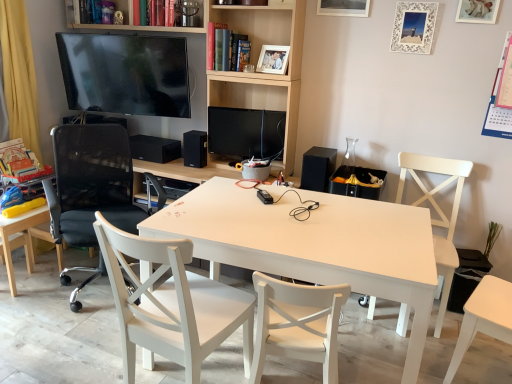
Describe the element at coordinates (477, 11) in the screenshot. I see `matte white picture frame at upper right, placed as the first picture frame when sorted from right to left` at that location.

Describe the element at coordinates (414, 27) in the screenshot. I see `white lace picture frame at upper right, placed as the third picture frame when sorted from left to right` at that location.

The width and height of the screenshot is (512, 384). Describe the element at coordinates (172, 303) in the screenshot. I see `white wood chair at center, the 3th chair viewed from the left` at that location.

How much space does white matte chair at center, arranged as the fourth chair when viewed from the left, occupy vertically?

The height of white matte chair at center, arranged as the fourth chair when viewed from the left, is 30.88 inches.

Where is `matte white picture frame at upper right, which is the fourth picture frame from left to right`? Image resolution: width=512 pixels, height=384 pixels. matte white picture frame at upper right, which is the fourth picture frame from left to right is located at coordinates (477, 11).

Consider the image. Which of these two, wooden photo frame at upper center, the 4th picture frame positioned from the right, or matte white picture frame at upper right, placed as the first picture frame when sorted from right to left, is smaller?

With smaller size is matte white picture frame at upper right, placed as the first picture frame when sorted from right to left.

Could you measure the distance between wooden photo frame at upper center, the 4th picture frame positioned from the right, and matte white picture frame at upper right, which is the fourth picture frame from left to right?

A distance of 3.53 feet exists between wooden photo frame at upper center, the 4th picture frame positioned from the right, and matte white picture frame at upper right, which is the fourth picture frame from left to right.

From the picture: Is wooden photo frame at upper center, the 1th picture frame in the left-to-right sequence, located outside matte white picture frame at upper right, placed as the first picture frame when sorted from right to left?

That's correct, wooden photo frame at upper center, the 1th picture frame in the left-to-right sequence, is outside of matte white picture frame at upper right, placed as the first picture frame when sorted from right to left.

Looking at their sizes, would you say wooden photo frame at upper center, the 4th picture frame positioned from the right, is wider or thinner than matte white picture frame at upper right, which is the fourth picture frame from left to right?

wooden photo frame at upper center, the 4th picture frame positioned from the right, is wider than matte white picture frame at upper right, which is the fourth picture frame from left to right.

How many degrees apart are the facing directions of black matte speaker at center, which is counted as the 3th speaker, starting from the front, and black mesh office chair at left?

The angle between the facing direction of black matte speaker at center, which is counted as the 3th speaker, starting from the front, and the facing direction of black mesh office chair at left is 2.14 degrees.

Is black matte speaker at center, which is counted as the first speaker, starting from the left, not near black mesh office chair at left?

No, there isn't a large distance between black matte speaker at center, which is counted as the first speaker, starting from the left, and black mesh office chair at left.

Consider the image. Is black matte speaker at center, which is counted as the 3th speaker, starting from the front, situated inside black mesh office chair at left or outside?

black matte speaker at center, which is counted as the 3th speaker, starting from the front, is spatially situated outside black mesh office chair at left.

The height and width of the screenshot is (384, 512). What are the coordinates of `speaker that is the 3rd one when counting upward from the black mesh office chair at left (from the image's perspective)` in the screenshot? It's located at (154, 148).

Which object is further away from the camera, matte black tv at upper left or wooden photo frame at upper center, the 1th picture frame in the left-to-right sequence?

Positioned behind is matte black tv at upper left.

Can you confirm if matte black tv at upper left is taller than wooden photo frame at upper center, the 1th picture frame in the left-to-right sequence?

Correct, matte black tv at upper left is much taller as wooden photo frame at upper center, the 1th picture frame in the left-to-right sequence.

Looking at their sizes, would you say matte black tv at upper left is wider or thinner than wooden photo frame at upper center, the 4th picture frame positioned from the right?

matte black tv at upper left is wider than wooden photo frame at upper center, the 4th picture frame positioned from the right.

Is hardcover book at upper center, the second book positioned from the left, spatially inside white matte table at center, or outside of it?

hardcover book at upper center, the second book positioned from the left, is located beyond the bounds of white matte table at center.

Does hardcover book at upper center, which is the first book from right to left, have a lesser width compared to white matte table at center?

Indeed, hardcover book at upper center, which is the first book from right to left, has a lesser width compared to white matte table at center.

How distant is hardcover book at upper center, the second book positioned from the left, from white matte table at center?

The distance of hardcover book at upper center, the second book positioned from the left, from white matte table at center is 4.34 feet.

Is hardcover book at upper center, which is the second book from top to bottom, looking in the opposite direction of white matte table at center?

No, hardcover book at upper center, which is the second book from top to bottom,'s orientation is not away from white matte table at center.

Would you say matte black monitor at center is outside hardcover book at upper center, the second book positioned from the left?

Yes, matte black monitor at center is outside of hardcover book at upper center, the second book positioned from the left.

Is matte black monitor at center not close to hardcover book at upper center, which is the first book from right to left?

matte black monitor at center is actually quite close to hardcover book at upper center, which is the first book from right to left.

Can you confirm if matte black monitor at center is positioned to the right of hardcover book at upper center, the second book positioned from the left?

Correct, you'll find matte black monitor at center to the right of hardcover book at upper center, the second book positioned from the left.

Is matte black monitor at center positioned in front of hardcover book at upper center, which is the first book from right to left?

No, matte black monitor at center is behind hardcover book at upper center, which is the first book from right to left.

Is point (365, 14) farther from viewer compared to point (153, 82)?

No, it is not.

Is white matte picture frame at upper center, which appears as the 3th picture frame when viewed from the right, situated inside matte black tv at upper left or outside?

white matte picture frame at upper center, which appears as the 3th picture frame when viewed from the right, is outside matte black tv at upper left.

Can you confirm if white matte picture frame at upper center, the second picture frame viewed from the left, is taller than matte black tv at upper left?

In fact, white matte picture frame at upper center, the second picture frame viewed from the left, may be shorter than matte black tv at upper left.

From the image's perspective, is black matte speaker at center, arranged as the second speaker when viewed from the left, over hardcover book at upper center, arranged as the first book when ordered from the bottom?

No, from the image's perspective, black matte speaker at center, arranged as the second speaker when viewed from the left, is not above hardcover book at upper center, arranged as the first book when ordered from the bottom.

Is black matte speaker at center, arranged as the second speaker when viewed from the left, positioned beyond the bounds of hardcover book at upper center, arranged as the first book when ordered from the bottom?

black matte speaker at center, arranged as the second speaker when viewed from the left, lies outside hardcover book at upper center, arranged as the first book when ordered from the bottom,'s area.

Is black matte speaker at center, arranged as the second speaker when viewed from the left, not near hardcover book at upper center, arranged as the first book when ordered from the bottom?

That's not correct — black matte speaker at center, arranged as the second speaker when viewed from the left, is a little close to hardcover book at upper center, arranged as the first book when ordered from the bottom.

Which picture frame is the 3rd one when counting from the front of the wooden photo frame at upper center, the 1th picture frame in the left-to-right sequence? Please provide its 2D coordinates.

[(477, 11)]

Identify the location of speaker that is the 1st object above the black mesh office chair at left (from a real-world perspective). The height and width of the screenshot is (384, 512). (154, 148).

When comparing their distances from hardcover book at upper center, the 2th book when ordered from bottom to top, does matte black monitor at center or yellow fabric chair at left, the 5th chair when ordered from right to left, seem closer?

matte black monitor at center is positioned closer to the anchor hardcover book at upper center, the 2th book when ordered from bottom to top.

Looking at this image, considering their positions, is matte black monitor at center positioned closer to matte white picture frame at upper right, which is the fourth picture frame from left to right, than matte black tv at upper left?

The object closer to matte white picture frame at upper right, which is the fourth picture frame from left to right, is matte black monitor at center.

Considering their positions, is matte black monitor at center positioned further to white matte table at center than hardcover book at upper center, the 2th book when ordered from bottom to top?

hardcover book at upper center, the 2th book when ordered from bottom to top, is further to white matte table at center.

Which object lies nearer to the anchor point white matte chair at center, arranged as the second chair when viewed from the right, matte white picture frame at upper right, which is the fourth picture frame from left to right, or yellow fabric chair at left, the 5th chair when ordered from right to left?

yellow fabric chair at left, the 5th chair when ordered from right to left, is positioned closer to the anchor white matte chair at center, arranged as the second chair when viewed from the right.

From the image, which object appears to be farther from black matte speaker at center, which is counted as the first speaker, starting from the left, matte black monitor at center or white wood chair at center, arranged as the 3th chair when viewed from the right?

The object further to black matte speaker at center, which is counted as the first speaker, starting from the left, is white wood chair at center, arranged as the 3th chair when viewed from the right.

From the image, which object appears to be farther from matte black tv at upper left, wooden photo frame at upper center, the 4th picture frame positioned from the right, or white wood chair at center, the 3th chair viewed from the left?

white wood chair at center, the 3th chair viewed from the left, is further to matte black tv at upper left.

Estimate the real-world distances between objects in this image. Which object is closer to white matte chair at center, arranged as the fourth chair when viewed from the left, white wood chair at center, the 3th chair viewed from the left, or black matte speaker at center, the 1th speaker in the back-to-front sequence?

Among the two, white wood chair at center, the 3th chair viewed from the left, is located nearer to white matte chair at center, arranged as the fourth chair when viewed from the left.

From the image, which object appears to be nearer to matte white picture frame at upper right, placed as the first picture frame when sorted from right to left, white matte chair at center, arranged as the second chair when viewed from the right, or white lace picture frame at upper right, marked as the second picture frame in a right-to-left arrangement?

Based on the image, white lace picture frame at upper right, marked as the second picture frame in a right-to-left arrangement, appears to be nearer to matte white picture frame at upper right, placed as the first picture frame when sorted from right to left.

At what (x,y) coordinates should I click in order to perform the action: click on chair between white wood chair at center, the 3th chair viewed from the left, and white wood chair at right, acting as the fifth chair starting from the left, from left to right. Please return your answer as a coordinate pair (x, y). This screenshot has width=512, height=384. Looking at the image, I should click on (297, 323).

Locate an element on the screen. book between white matte picture frame at upper center, the second picture frame viewed from the left, and black matte speaker at upper right, marked as the 1th speaker in a front-to-back arrangement, from top to bottom is located at coordinates (222, 47).

What are the coordinates of `picture frame located between yellow fabric chair at left, the 5th chair when ordered from right to left, and black matte speaker at upper right, which is the third speaker in back-to-front order, in the left-right direction` in the screenshot? It's located at (273, 59).

Image resolution: width=512 pixels, height=384 pixels. Identify the location of computer monitor between black mesh office chair at left, which is the 2th chair from left to right, and black matte speaker at center, which is counted as the first speaker, starting from the left, from front to back. (246, 133).